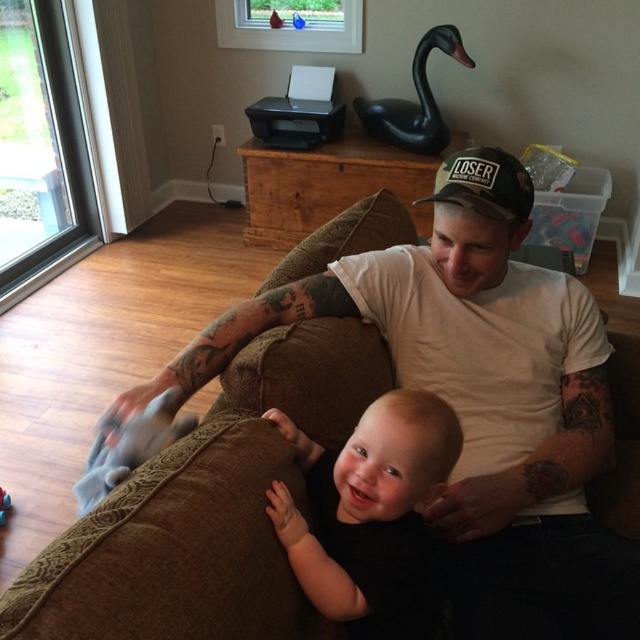
Does white t-shirt at center have a greater width compared to black matte baby at center?

Indeed, white t-shirt at center has a greater width compared to black matte baby at center.

Can you confirm if white t-shirt at center is shorter than black matte baby at center?

No, white t-shirt at center is not shorter than black matte baby at center.

Does point (307, 307) come in front of point (316, 570)?

No.

The height and width of the screenshot is (640, 640). I want to click on white t-shirt at center, so click(x=480, y=417).

Who is lower down, white t-shirt at center or black fabric baseball cap at center?

white t-shirt at center

Which is above, white t-shirt at center or black fabric baseball cap at center?

black fabric baseball cap at center is higher up.

Between point (604, 467) and point (419, 202), which one is positioned in front?

Point (604, 467) is more forward.

Where is `white t-shirt at center`? white t-shirt at center is located at coordinates (480, 417).

Who is shorter, black matte baby at center or rubber duck at lower left?

With less height is rubber duck at lower left.

Is black matte baby at center closer to camera compared to rubber duck at lower left?

Yes, it is.

In order to click on black matte baby at center in this screenshot , I will do `click(369, 515)`.